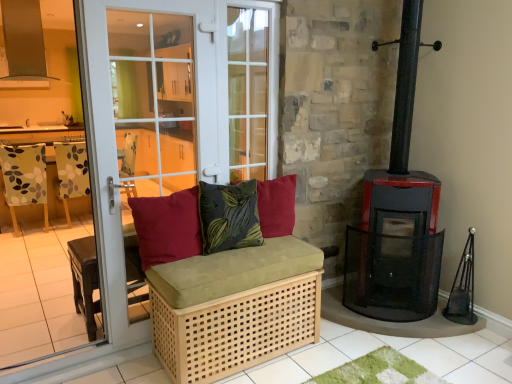
Identify the location of empty space that is ontop of natural wood woven basket at lower center. (227, 256).